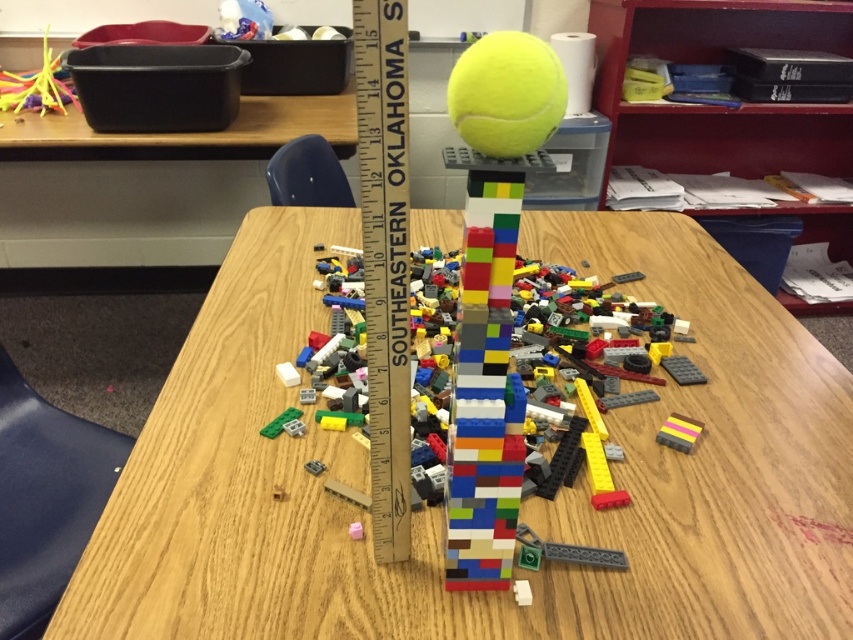
You are a student in the classroom and want to place a textbook on the wooden table at center. If the textbook is 3 centimeters thick, will it fit on the table without falling off?

The wooden table at center is 56.85 centimeters away from the viewer, but the textbook is only 3 centimeters thick. The distance from the viewer does not affect the textbook fitting on the table. The textbook will fit as long as its dimensions are within the table surface. However, the scene description mentions a LEGO tower and tennis ball on the table, so there might be limited space. Without knowing the table size, we cannot confirm if it will fit. However, the question specifically asks about thickness,

You are a student in the classroom and want to place a textbook between the wooden table at center and the wooden at center. Can you do this?

The distance between the wooden table at center and the wooden at center is 15.08 inches. Since textbooks are typically around 1 inch thick, you can place the textbook between them.